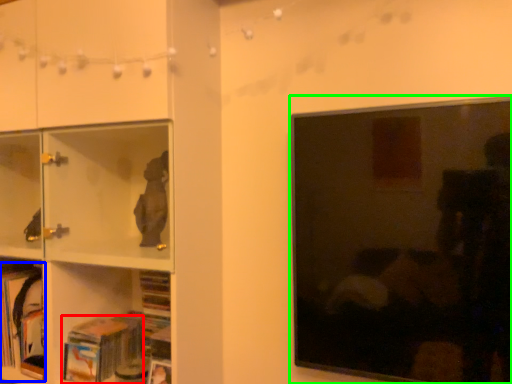
Question: Considering the real-world distances, which object is closest to book (highlighted by a red box)? book (highlighted by a blue box) or picture frame (highlighted by a green box).

Choices:
 (A) book
 (B) picture frame

Answer: (A)